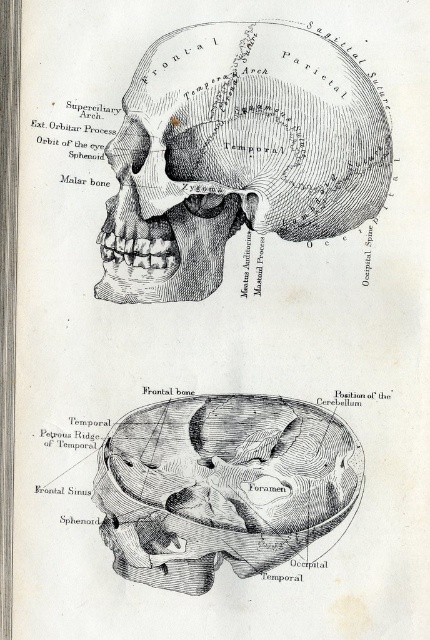
You are an art student analyzing the two skull depictions in the image. The etched paper skull at upper center and the black ink drawing of skull at center are both part of your study. Based on their sizes, which one would require more space on your sketchbook page if you were to copy them exactly?

The etched paper skull at upper center requires more space because its width surpasses that of the black ink drawing of skull at center.

You are an art student analyzing the anatomical illustrations. You notice two skulls in the image. Which one is taller? The etched paper skull at upper center or the black ink drawing of skull at center?

The etched paper skull at upper center is taller than the black ink drawing of skull at center according to the description.